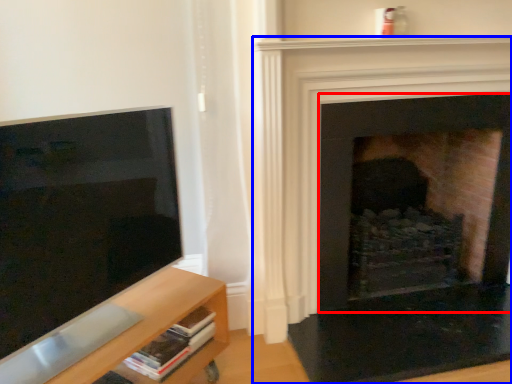
Question: Which point is closer to the camera, fireplace (highlighted by a red box) or fireplace (highlighted by a blue box)?

Choices:
 (A) fireplace
 (B) fireplace

Answer: (B)